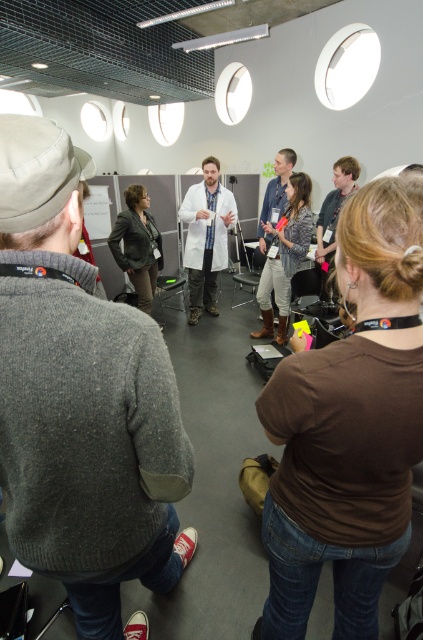
You are organizing a photo shoot and need to ensure that the brown cotton shirt at center and the light brown leather jacket at center are visible in the frame. Given that the camera has a fixed focal length, which clothing item should you position closer to the camera to ensure both fit within the frame without cropping?

The brown cotton shirt at center is wider than the light brown leather jacket at center. To ensure both fit within the frame, position the brown cotton shirt at center closer to the camera since wider objects require more space in the frame and positioning them closer helps maintain their visibility without cropping.